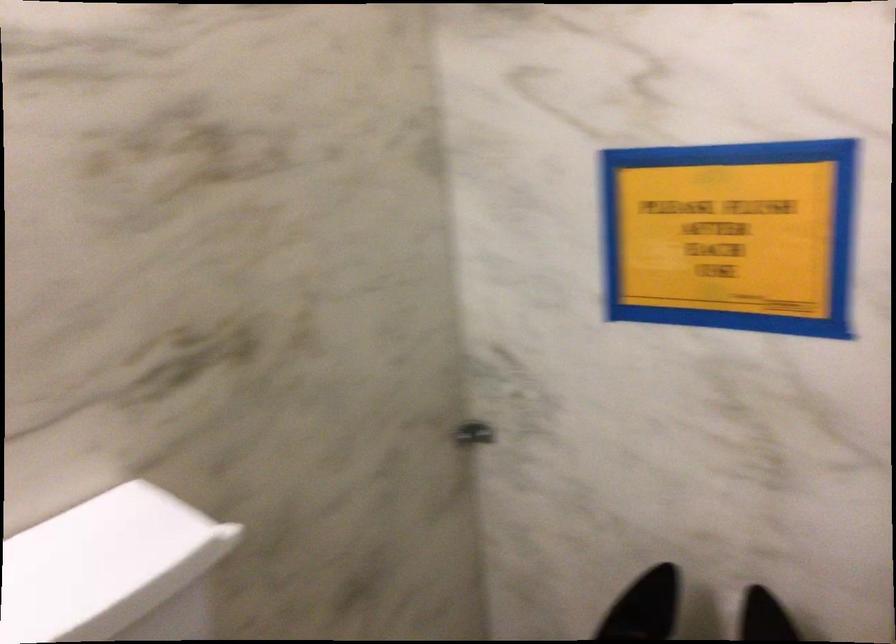
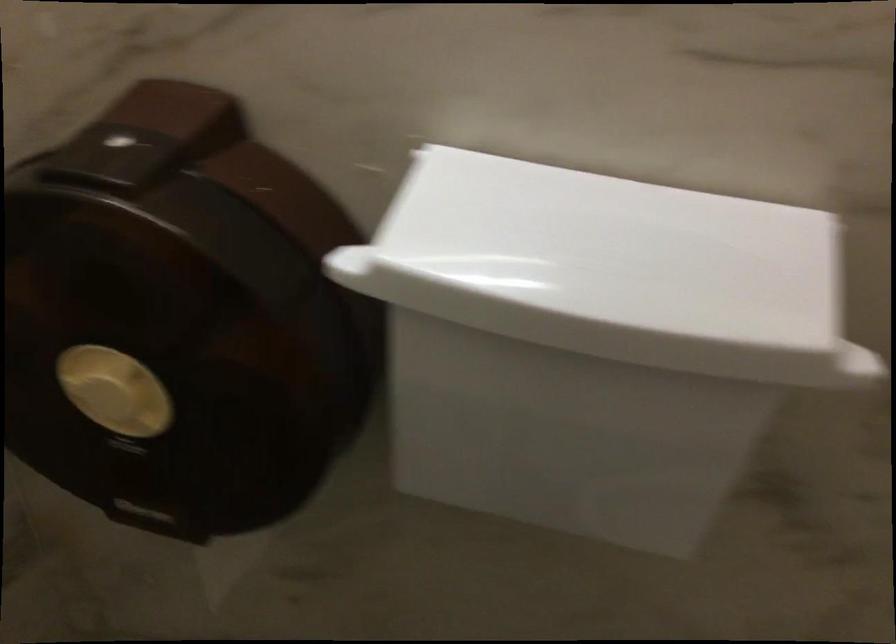
The first image is from the beginning of the video and the second image is from the end. How did the camera likely rotate when shooting the video?

The rotation direction of the camera is left-down.